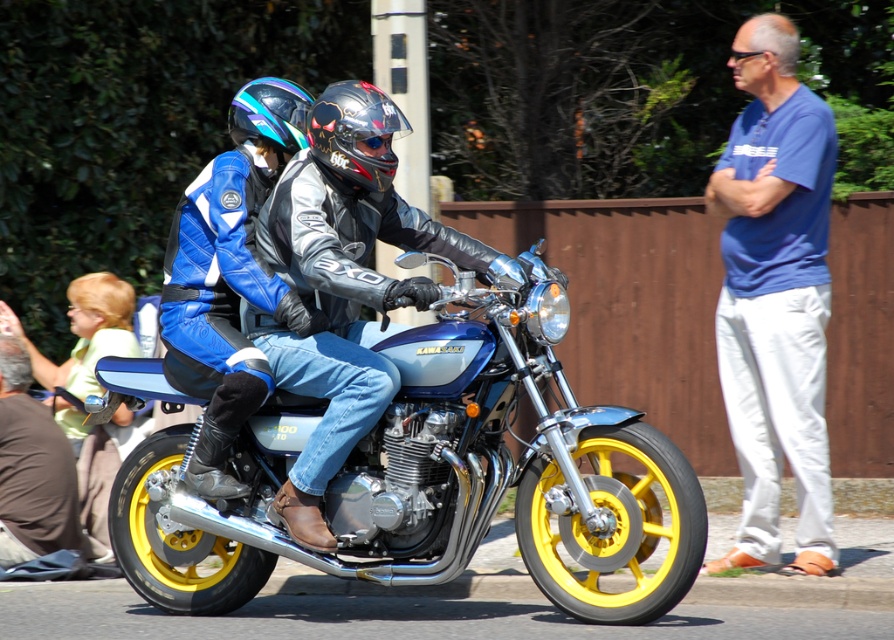
Question: Is blue cotton shirt at right wider than shiny blue and white helmet at upper left?

Choices:
 (A) no
 (B) yes

Answer: (B)

Question: Can you confirm if shiny metallic motorcycle at center is smaller than glossy black helmet at center?

Choices:
 (A) no
 (B) yes

Answer: (A)

Question: Which point is farther to the camera?

Choices:
 (A) (294, 109)
 (B) (796, 99)

Answer: (A)

Question: Among these objects, which one is nearest to the camera?

Choices:
 (A) shiny blue and white helmet at upper left
 (B) blue cotton shirt at right

Answer: (B)

Question: Is blue cotton shirt at right closer to the viewer compared to shiny blue and white helmet at upper left?

Choices:
 (A) no
 (B) yes

Answer: (B)

Question: Which object appears farthest from the camera in this image?

Choices:
 (A) brown leather jacket at lower left
 (B) shiny black leather jacket at center

Answer: (A)